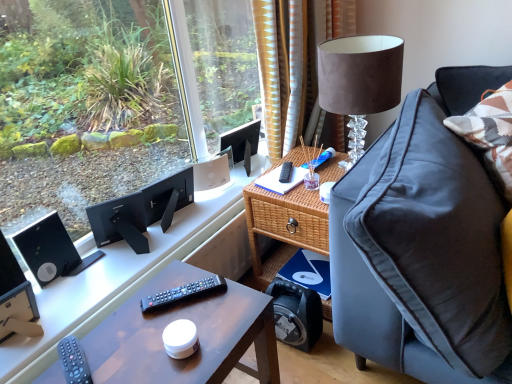
Find the location of a particular element. The height and width of the screenshot is (384, 512). free space in front of black plastic remote at center, marked as the 2th remote control in a back-to-front arrangement is located at coordinates (162, 337).